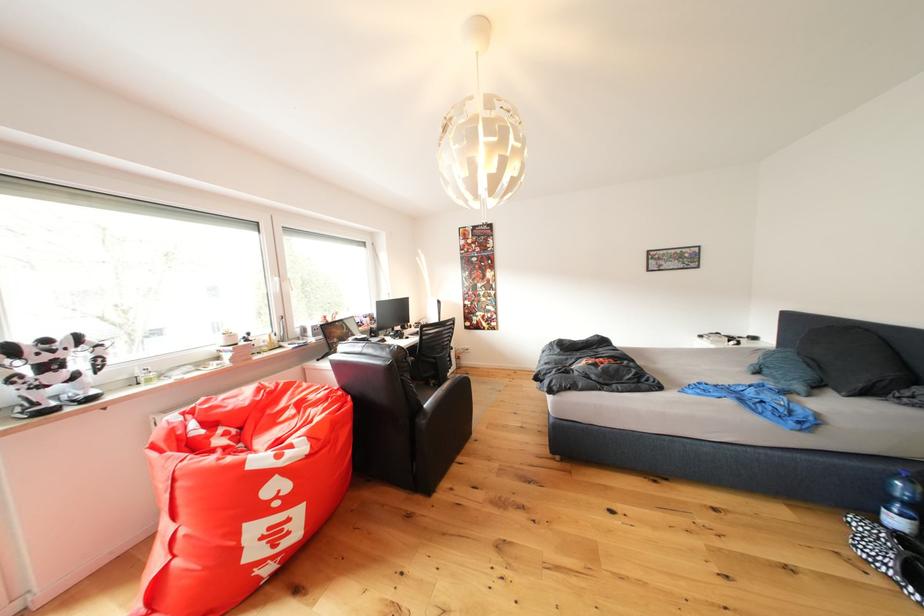
This screenshot has width=924, height=616. Describe the element at coordinates (451, 400) in the screenshot. I see `the black chair sitting surface` at that location.